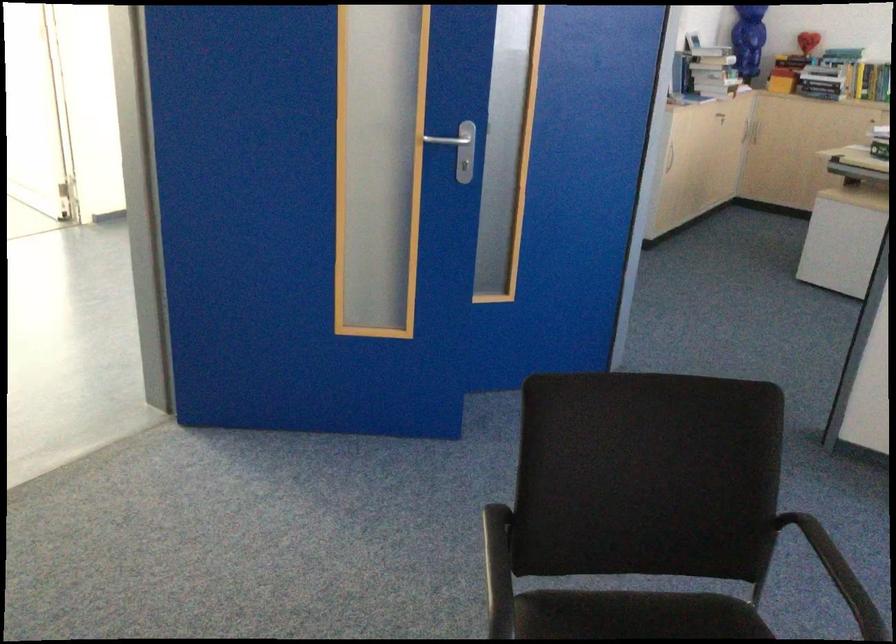
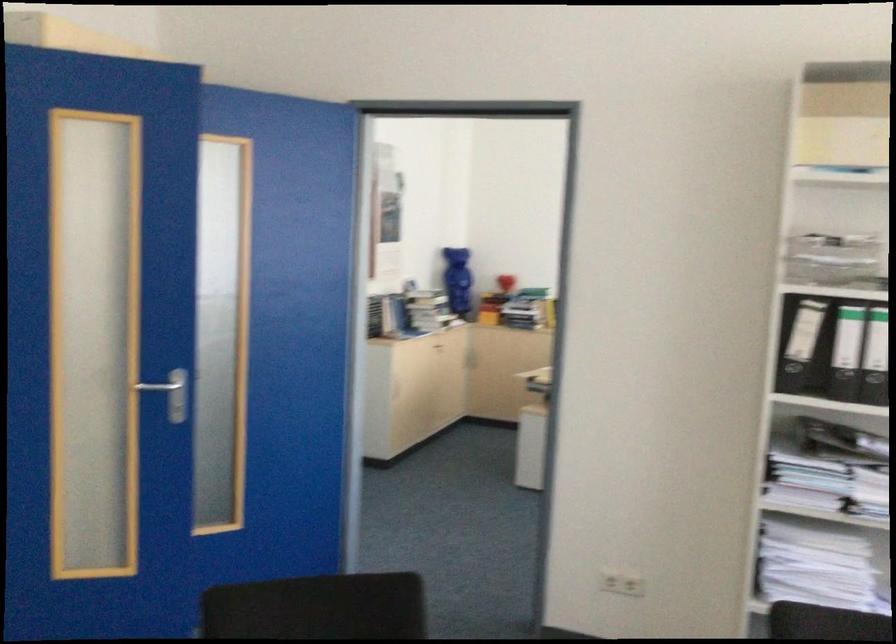
In the second image, find the point that corresponds to [462,154] in the first image.

(176, 398)